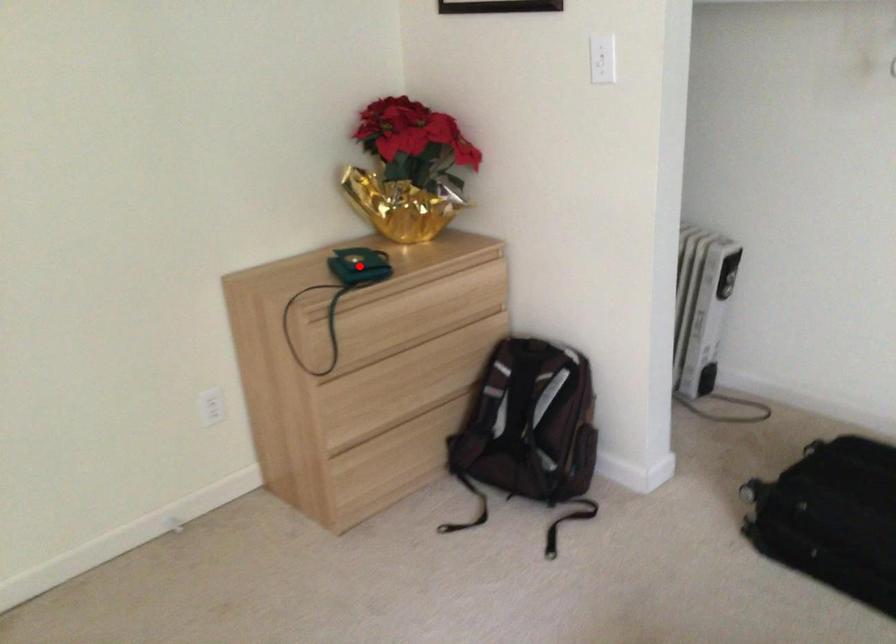
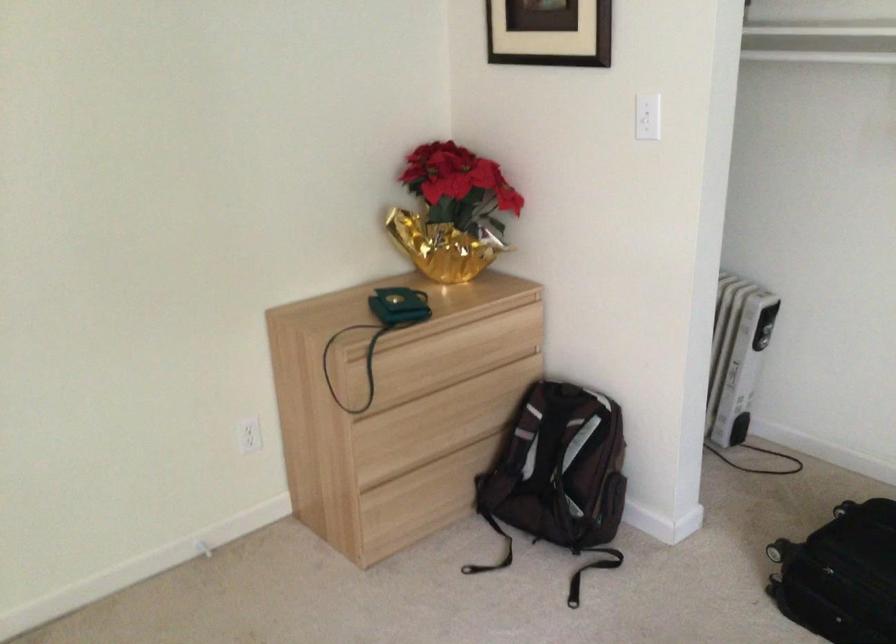
Find the pixel in the second image that matches the highlighted location in the first image.

(399, 306)